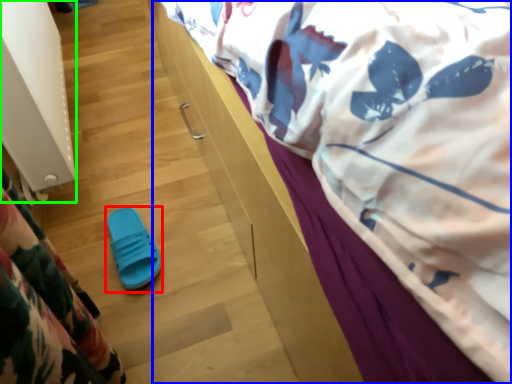
Question: Based on their relative distances, which object is nearer to footwear (highlighted by a red box)? Choose from bed (highlighted by a blue box) and radiator (highlighted by a green box).

Choices:
 (A) bed
 (B) radiator

Answer: (B)